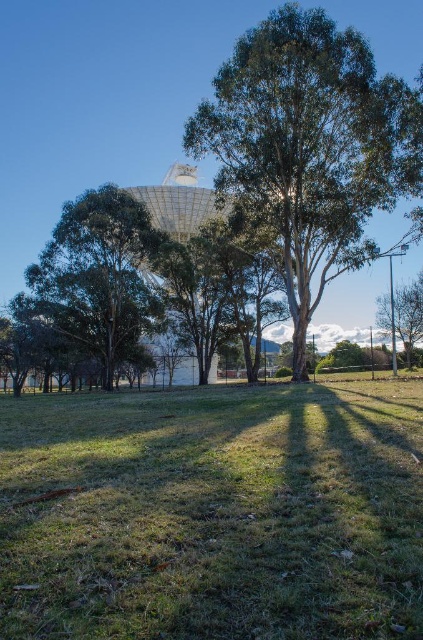
Measure the distance from green leafy tree at center to green leafy tree at left.

green leafy tree at center is 13.06 meters away from green leafy tree at left.

Can you confirm if green leafy tree at center is positioned above green leafy tree at left?

Correct, green leafy tree at center is located above green leafy tree at left.

Is point (351, 32) less distant than point (27, 284)?

Yes, point (351, 32) is in front of point (27, 284).

At what (x,y) coordinates should I click in order to perform the action: click on green leafy tree at center. Please return your answer as a coordinate pair (x, y). This screenshot has width=423, height=640. Looking at the image, I should click on (310, 147).

Who is more distant from viewer, (87, 230) or (376, 298)?

The point (376, 298) is more distant.

Who is positioned more to the left, green leafy tree at left or green leafy tree at right?

green leafy tree at left is more to the left.

Who is more distant from viewer, (112, 358) or (395, 304)?

The point (395, 304) is behind.

This screenshot has width=423, height=640. I want to click on green leafy tree at left, so click(x=96, y=275).

Is green grass at center bigger than green leafy tree at right?

Actually, green grass at center might be smaller than green leafy tree at right.

Does green grass at center have a lesser width compared to green leafy tree at right?

No.

Consider the image. Measure the distance between point (x=95, y=460) and camera.

A distance of 6.27 meters exists between point (x=95, y=460) and camera.

Find the location of a particular element. This screenshot has height=640, width=423. green grass at center is located at coordinates (213, 513).